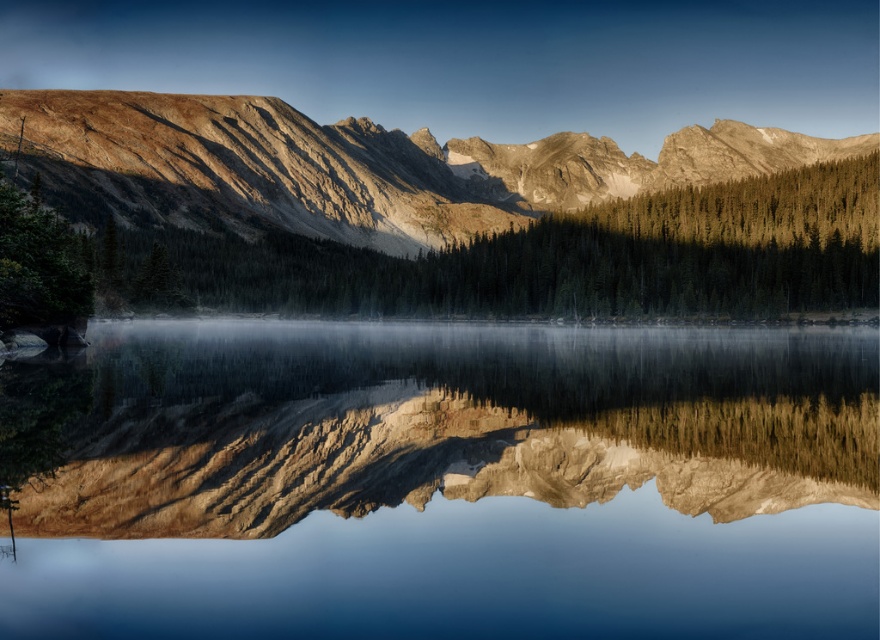
You are standing at the point with coordinates point (869, 253) and want to walk towards the point with coordinates point (92, 204). Which direction should you walk to reach there?

You should walk forward because point (92, 204) is behind point (869, 253), meaning it is in the direction you are facing.